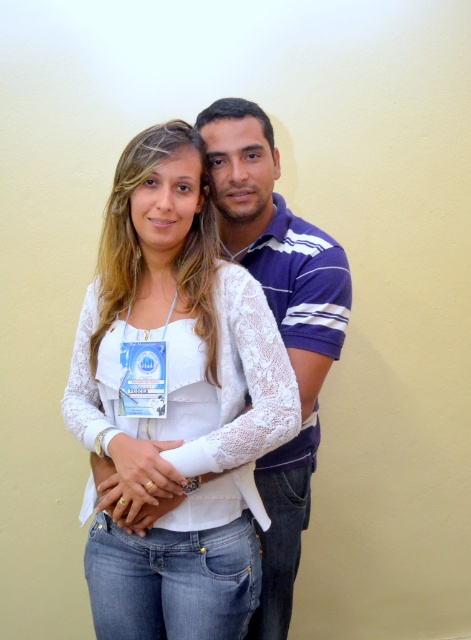
You are a photographer trying to capture a clear photo of both the white lace top at center and the blue striped polo shirt at center. Based on their positions, which one is more likely to be fully visible in the frame?

The white lace top at center is more likely to be fully visible in the frame since it might be wider than the blue striped polo shirt at center, allowing it to occupy more space in the image.

What are the coordinates of the white lace top at center?

The white lace top at center is located at coordinates point (171, 310).